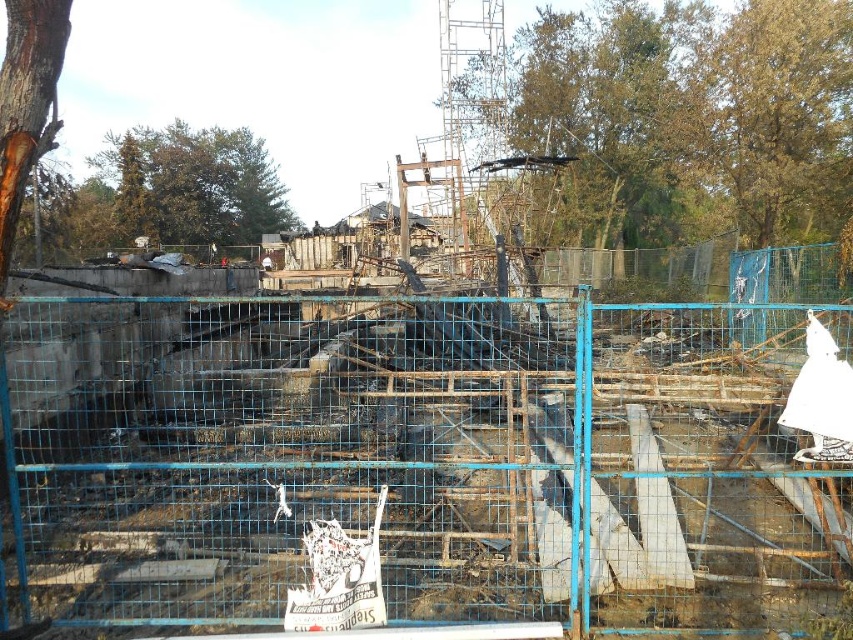
Which of these two, green leafy tree at upper left or brown rough bark at left, stands taller?

green leafy tree at upper left is taller.

This screenshot has width=853, height=640. What are the coordinates of `green leafy tree at upper left` in the screenshot? It's located at click(x=193, y=186).

Does green leafy tree at upper center have a greater width compared to green leafy tree at upper left?

Incorrect, green leafy tree at upper center's width does not surpass green leafy tree at upper left's.

Is green leafy tree at upper center to the right of green leafy tree at upper left from the viewer's perspective?

Yes, green leafy tree at upper center is to the right of green leafy tree at upper left.

What are the coordinates of `green leafy tree at upper center` in the screenshot? It's located at (685, 122).

Is green leafy tree at upper center taller than brown rough bark at left?

Indeed, green leafy tree at upper center has a greater height compared to brown rough bark at left.

Does point (845, 6) come behind point (33, 77)?

Yes, point (845, 6) is behind point (33, 77).

Does point (734, 17) come closer to viewer compared to point (15, 131)?

No, it is behind (15, 131).

Locate an element on the screen. The image size is (853, 640). green leafy tree at upper center is located at coordinates coord(685,122).